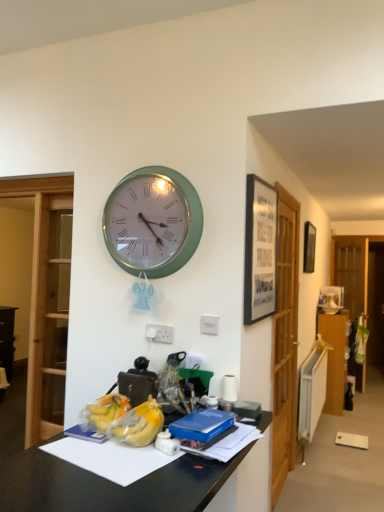
Measure the distance between wooden dresser at right and camera.

The distance of wooden dresser at right from camera is 4.59 meters.

What do you see at coordinates (202, 425) in the screenshot? This screenshot has height=512, width=384. I see `blue matte book at center` at bounding box center [202, 425].

The height and width of the screenshot is (512, 384). What do you see at coordinates (138, 424) in the screenshot? I see `translucent plastic bananas at center` at bounding box center [138, 424].

The width and height of the screenshot is (384, 512). I want to click on transparent wooden door at right, which is the 1th glass door in back-to-front order, so click(x=351, y=271).

The height and width of the screenshot is (512, 384). Describe the element at coordinates (309, 247) in the screenshot. I see `matte black picture frame at upper right, arranged as the 2th picture frame when viewed from the left` at that location.

Identify the location of matte black picture frame at upper right, which is counted as the second picture frame, starting from the front. This screenshot has width=384, height=512. (309, 247).

At what (x,y) coordinates should I click in order to perform the action: click on black matte picture frame at upper right, placed as the first picture frame when sorted from front to back. Please return your answer as a coordinate pair (x, y). Looking at the image, I should click on (260, 250).

Locate an element on the screen. This screenshot has width=384, height=512. wooden dresser at right is located at coordinates (335, 358).

Would you say matte black picture frame at upper right, which is the first picture frame in right-to-left order, is outside wooden dresser at right?

Yes, matte black picture frame at upper right, which is the first picture frame in right-to-left order, is outside of wooden dresser at right.

Is matte black picture frame at upper right, which is counted as the second picture frame, starting from the front, positioned behind wooden dresser at right?

No, it is in front of wooden dresser at right.

Is matte black picture frame at upper right, which is the first picture frame in right-to-left order, to the left of wooden dresser at right from the viewer's perspective?

Yes.

Which is more to the left, transparent wooden door at right, which appears as the 2th glass door when viewed from the front, or wooden glass door at center, the first glass door viewed from the left?

Positioned to the left is wooden glass door at center, the first glass door viewed from the left.

Who is taller, transparent wooden door at right, which appears as the 2th glass door when viewed from the front, or wooden glass door at center, the first glass door viewed from the left?

wooden glass door at center, the first glass door viewed from the left.

Is transparent wooden door at right, positioned as the second glass door in left-to-right order, far from wooden glass door at center, which is the 1th glass door from front to back?

Yes, transparent wooden door at right, positioned as the second glass door in left-to-right order, and wooden glass door at center, which is the 1th glass door from front to back, are quite far apart.

In the scene shown: Does transparent wooden door at right, which appears as the 2th glass door when viewed from the front, have a greater width compared to wooden glass door at center, which is the 1th glass door from front to back?

Indeed, transparent wooden door at right, which appears as the 2th glass door when viewed from the front, has a greater width compared to wooden glass door at center, which is the 1th glass door from front to back.

Is green metallic wall clock at upper center positioned with its back to translucent plastic bananas at center?

No, green metallic wall clock at upper center is not facing away from translucent plastic bananas at center.

From the image's perspective, is green metallic wall clock at upper center located beneath translucent plastic bananas at center?

Incorrect, from the image's perspective, green metallic wall clock at upper center is higher than translucent plastic bananas at center.

Is green metallic wall clock at upper center with translucent plastic bananas at center?

No, green metallic wall clock at upper center is not making contact with translucent plastic bananas at center.

Is green metallic wall clock at upper center wider or thinner than translucent plastic bananas at center?

Considering their sizes, green metallic wall clock at upper center looks slimmer than translucent plastic bananas at center.

How many degrees apart are the facing directions of wooden dresser at right and transparent wooden door at right, the first glass door viewed from the right?

The angle between the facing direction of wooden dresser at right and the facing direction of transparent wooden door at right, the first glass door viewed from the right, is 34 degrees.

From the picture: Considering the positions of objects wooden dresser at right and transparent wooden door at right, which appears as the 2th glass door when viewed from the front, in the image provided, who is more to the right, wooden dresser at right or transparent wooden door at right, which appears as the 2th glass door when viewed from the front,?

Positioned to the right is transparent wooden door at right, which appears as the 2th glass door when viewed from the front.

Can you confirm if wooden dresser at right is thinner than transparent wooden door at right, the first glass door viewed from the right?

No.

Considering the relative sizes of black glossy desk at lower center and translucent plastic bananas at center in the image provided, is black glossy desk at lower center thinner than translucent plastic bananas at center?

No.

At what (x,y) coordinates should I click in order to perform the action: click on desk located below the translucent plastic bananas at center (from the image's perspective). Please return your answer as a coordinate pair (x, y). The image size is (384, 512). Looking at the image, I should click on (109, 485).

Can you confirm if black glossy desk at lower center is smaller than translucent plastic bananas at center?

No, black glossy desk at lower center is not smaller than translucent plastic bananas at center.

Which of these two, green metallic wall clock at upper center or black glossy desk at lower center, is thinner?

Thinner between the two is green metallic wall clock at upper center.

Considering the relative sizes of green metallic wall clock at upper center and black glossy desk at lower center in the image provided, is green metallic wall clock at upper center smaller than black glossy desk at lower center?

Yes.

Is green metallic wall clock at upper center directly adjacent to black glossy desk at lower center?

green metallic wall clock at upper center is not next to black glossy desk at lower center, and they're not touching.

Is green metallic wall clock at upper center aimed at black glossy desk at lower center?

No.

In the image, is black glossy desk at lower center positioned in front of or behind green metallic wall clock at upper center?

black glossy desk at lower center is positioned closer to the viewer than green metallic wall clock at upper center.

Consider the image. From a real-world perspective, is black glossy desk at lower center positioned under green metallic wall clock at upper center based on gravity?

Indeed, from a real-world perspective, black glossy desk at lower center is positioned beneath green metallic wall clock at upper center.

Does point (241, 454) appear closer or farther from the camera than point (168, 236)?

Point (241, 454).

Which object is wider, black glossy desk at lower center or green metallic wall clock at upper center?

black glossy desk at lower center is wider.

Identify the location of picture frame that is the 2nd one above the wooden dresser at right (from a real-world perspective). The image size is (384, 512). (309, 247).

In the image, there is a wooden glass door at center, which is the 1th glass door from front to back. Identify the location of glass door below it (from the image's perspective). click(x=351, y=271).

Which object lies nearer to the anchor point transparent wooden door at right, which appears as the 2th glass door when viewed from the front, wooden dresser at right or black matte picture frame at upper right, which is the second picture frame in right-to-left order?

wooden dresser at right is closer to transparent wooden door at right, which appears as the 2th glass door when viewed from the front.

Considering their positions, is green metallic wall clock at upper center positioned further to wooden dresser at right than black matte picture frame at upper right, acting as the 2th picture frame starting from the back?

green metallic wall clock at upper center.

From the image, which object appears to be nearer to wooden glass door at center, which is the 1th glass door from front to back, matte black picture frame at upper right, placed as the first picture frame when sorted from back to front, or black matte picture frame at upper right, which is the second picture frame in right-to-left order?

black matte picture frame at upper right, which is the second picture frame in right-to-left order, is closer to wooden glass door at center, which is the 1th glass door from front to back.

Estimate the real-world distances between objects in this image. Which object is further from transparent wooden door at right, which is the 1th glass door in back-to-front order, black glossy desk at lower center or wooden dresser at right?

Based on the image, black glossy desk at lower center appears to be further to transparent wooden door at right, which is the 1th glass door in back-to-front order.

Based on their spatial positions, is transparent wooden door at right, which appears as the 2th glass door when viewed from the front, or blue matte book at center closer to black glossy desk at lower center?

blue matte book at center is positioned closer to the anchor black glossy desk at lower center.

Looking at the image, which one is located further to translucent plastic bananas at center, matte black picture frame at upper right, placed as the first picture frame when sorted from back to front, or blue matte book at center?

matte black picture frame at upper right, placed as the first picture frame when sorted from back to front.

Estimate the real-world distances between objects in this image. Which object is closer to black matte picture frame at upper right, which is the second picture frame in right-to-left order, blue matte book at center or transparent wooden door at right, which is the 1th glass door in back-to-front order?

blue matte book at center lies closer to black matte picture frame at upper right, which is the second picture frame in right-to-left order, than the other object.

Which object lies nearer to the anchor point wooden glass door at center, the first glass door viewed from the left, black glossy desk at lower center or black matte picture frame at upper right, which is the second picture frame in right-to-left order?

black matte picture frame at upper right, which is the second picture frame in right-to-left order, is positioned closer to the anchor wooden glass door at center, the first glass door viewed from the left.

I want to click on glass door between translucent plastic bananas at center and transparent wooden door at right, positioned as the second glass door in left-to-right order, along the z-axis, so click(285, 342).

Find the location of a particular element. This screenshot has height=512, width=384. picture frame located between black glossy desk at lower center and wooden glass door at center, marked as the 2th glass door in a right-to-left arrangement, in the depth direction is located at coordinates (260, 250).

Where is `glass door between black glossy desk at lower center and transparent wooden door at right, positioned as the second glass door in left-to-right order, from front to back`? The width and height of the screenshot is (384, 512). glass door between black glossy desk at lower center and transparent wooden door at right, positioned as the second glass door in left-to-right order, from front to back is located at coordinates (285, 342).

You are a GUI agent. You are given a task and a screenshot of the screen. Output one action in this format:
    pyautogui.click(x=<x>, y=<y>)
    Task: Click on the picture frame between translucent plastic bananas at center and matte black picture frame at upper right, which is counted as the second picture frame, starting from the front, along the z-axis
    Image resolution: width=384 pixels, height=512 pixels.
    Given the screenshot: What is the action you would take?
    pyautogui.click(x=260, y=250)